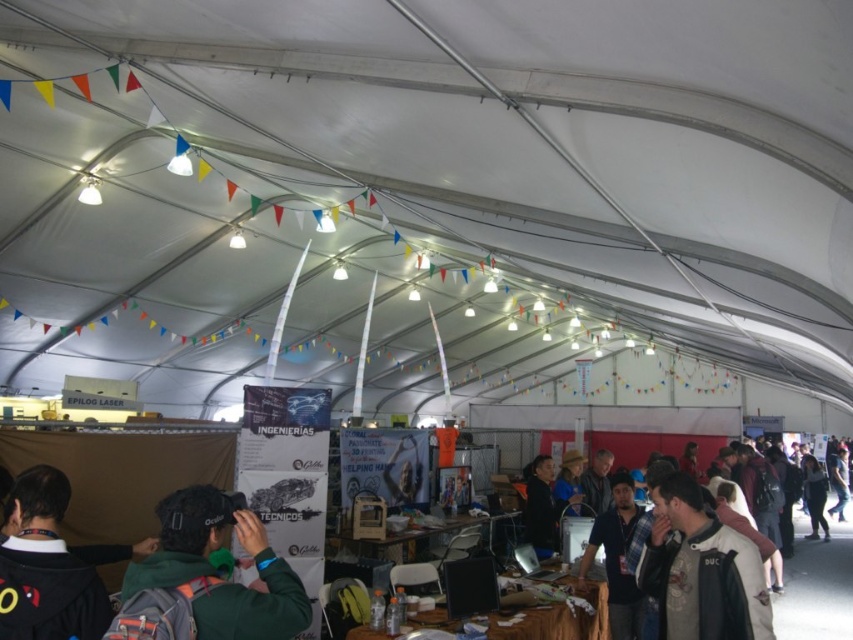
Who is lower down, dark brown leather jacket at lower right or wooden table at center?

wooden table at center

Between point (724, 620) and point (564, 632), which one is positioned in front?

Positioned in front is point (724, 620).

Find the location of `dark brown leather jacket at lower right`. dark brown leather jacket at lower right is located at coordinates (701, 570).

You are a GUI agent. You are given a task and a screenshot of the screen. Output one action in this format:
    pyautogui.click(x=<x>, y=<y>)
    Task: Click on the dark brown leather jacket at lower right
    The width and height of the screenshot is (853, 640).
    Given the screenshot: What is the action you would take?
    pyautogui.click(x=701, y=570)

Is point (258, 632) positioned in front of point (817, 605)?

That is True.

Which is in front, point (236, 497) or point (798, 548)?

Point (236, 497)

Who is more distant from viewer, [189,554] or [836,589]?

Positioned behind is point [836,589].

Find the location of a particular element. This screenshot has height=640, width=853. green fleece jacket at center is located at coordinates (207, 577).

Does green fleece jacket at center come behind dark brown leather jacket at lower right?

No, green fleece jacket at center is in front of dark brown leather jacket at lower right.

Who is positioned more to the right, green fleece jacket at center or dark brown leather jacket at lower right?

Positioned to the right is dark brown leather jacket at lower right.

Is point (189, 508) closer to camera compared to point (657, 504)?

That is True.

The height and width of the screenshot is (640, 853). Find the location of `green fleece jacket at center`. green fleece jacket at center is located at coordinates (207, 577).